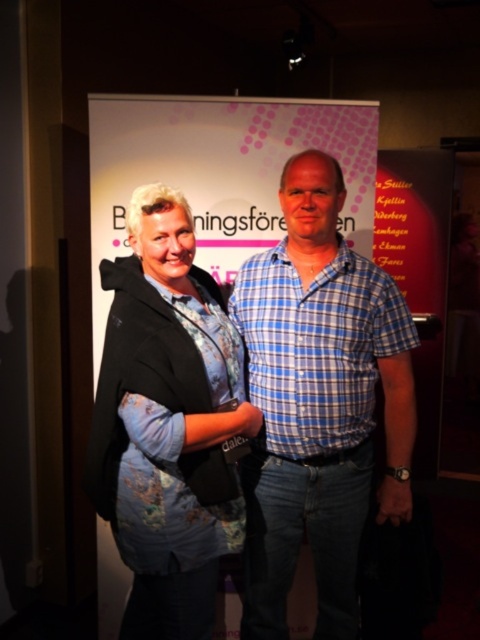
Question: Is blue plaid shirt at center behind floral fabric blouse at center?

Choices:
 (A) yes
 (B) no

Answer: (A)

Question: Is blue plaid shirt at center to the right of floral fabric blouse at center from the viewer's perspective?

Choices:
 (A) no
 (B) yes

Answer: (B)

Question: Is blue plaid shirt at center closer to the viewer compared to floral fabric blouse at center?

Choices:
 (A) no
 (B) yes

Answer: (A)